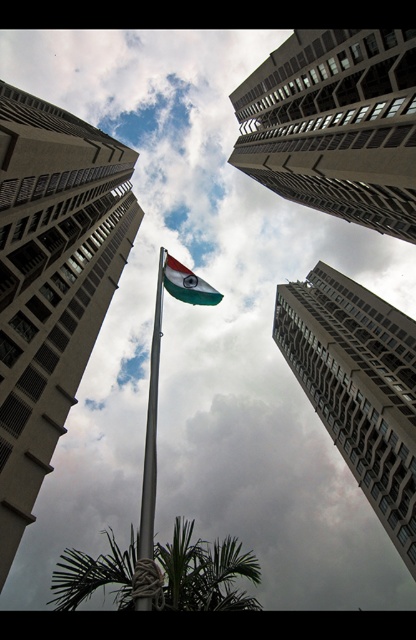
Between green leafy palm tree at lower center and tricolor fabric flag at center, which one has less height?

With less height is tricolor fabric flag at center.

Who is more forward, (173,564) or (166,282)?

Point (173,564) is more forward.

Which is in front, point (183, 516) or point (195, 276)?

Point (195, 276) is more forward.

This screenshot has width=416, height=640. I want to click on green leafy palm tree at lower center, so click(x=205, y=572).

Who is more distant from viewer, (124, 212) or (326, 426)?

Positioned behind is point (124, 212).

Does concrete building at center have a lesser width compared to gray concrete building at center?

Incorrect, concrete building at center's width is not less than gray concrete building at center's.

Who is more forward, (69,129) or (304,305)?

Positioned in front is point (69,129).

At what (x,y) coordinates should I click in order to perform the action: click on concrete building at center. Please return your answer as a coordinate pair (x, y). The image size is (416, 640). Looking at the image, I should click on coord(51,282).

Is metallic pole at center positioned behind tricolor fabric flag at center?

No.

Can you confirm if metallic pole at center is positioned above tricolor fabric flag at center?

No, metallic pole at center is not above tricolor fabric flag at center.

Find the location of a particular element. metallic pole at center is located at coordinates (151, 432).